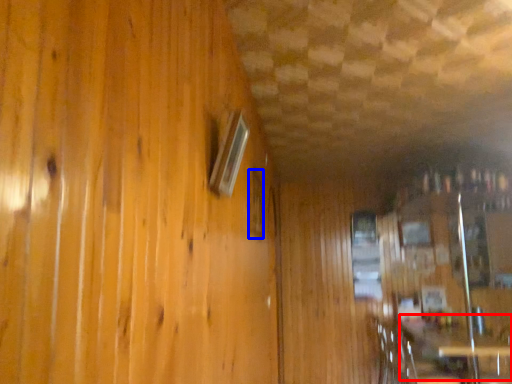
Question: Which object is further to the camera taking this photo, table (highlighted by a red box) or window (highlighted by a blue box)?

Choices:
 (A) table
 (B) window

Answer: (A)